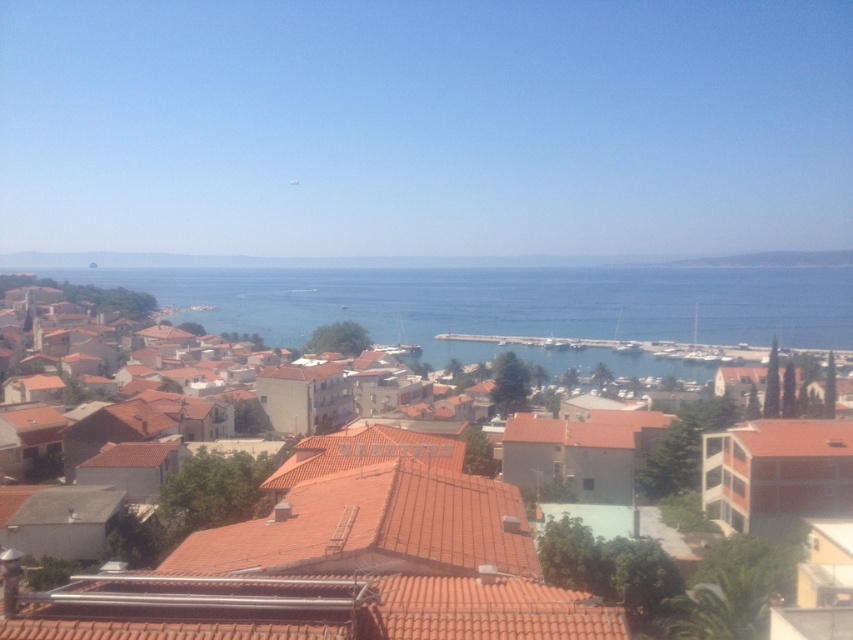
Question: Is brown tile roofs at center below blue water at center?

Choices:
 (A) yes
 (B) no

Answer: (A)

Question: Can you confirm if brown tile roofs at center is positioned below blue water at center?

Choices:
 (A) no
 (B) yes

Answer: (B)

Question: Which of the following is the closest to the observer?

Choices:
 (A) (318, 499)
 (B) (207, 285)

Answer: (A)

Question: Can you confirm if brown tile roofs at center is thinner than blue water at center?

Choices:
 (A) no
 (B) yes

Answer: (B)

Question: Among these objects, which one is farthest from the camera?

Choices:
 (A) brown tile roofs at center
 (B) blue water at center

Answer: (B)